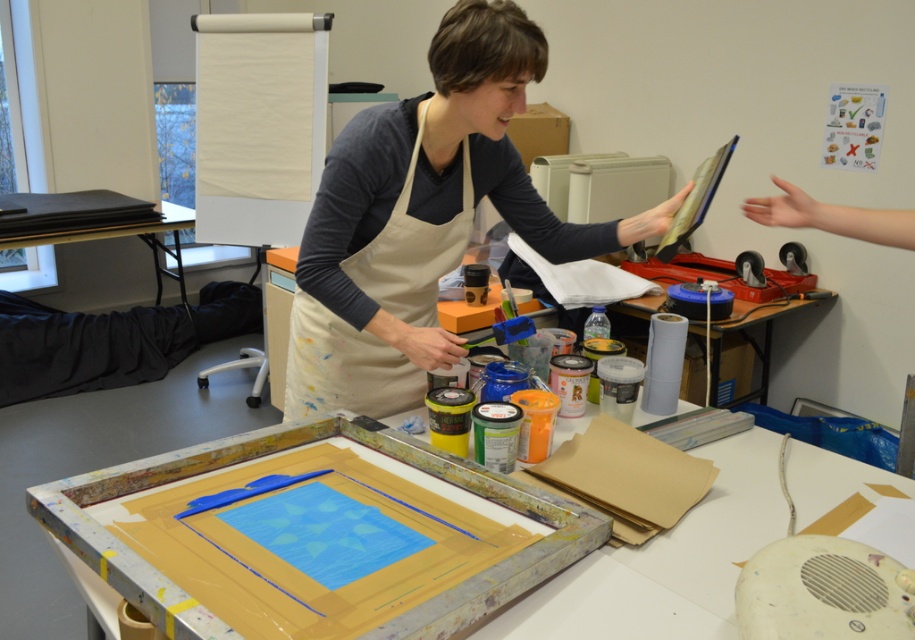
Question: Can you confirm if matte apron at center is positioned to the right of black paper at left?

Choices:
 (A) yes
 (B) no

Answer: (A)

Question: Is matte apron at center closer to the viewer compared to wooden table at center?

Choices:
 (A) no
 (B) yes

Answer: (A)

Question: Which object is the farthest from the matte apron at center?

Choices:
 (A) beige cotton apron at center
 (B) wooden table at center
 (C) black paper at left

Answer: (C)

Question: Which of these objects is positioned closest to the wooden table at center?

Choices:
 (A) beige cotton apron at center
 (B) matte apron at center
 (C) black paper at left

Answer: (A)

Question: Considering the real-world distances, which object is closest to the matte apron at center?

Choices:
 (A) beige cotton apron at center
 (B) black paper at left

Answer: (A)

Question: Is wooden table at center bigger than beige cotton apron at center?

Choices:
 (A) yes
 (B) no

Answer: (A)